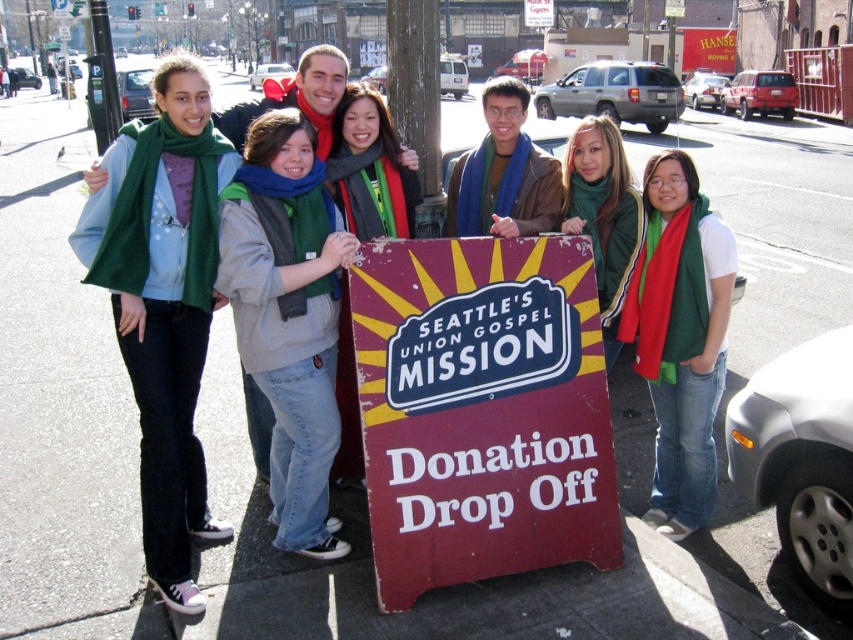
Question: Which point appears farthest from the camera in this image?

Choices:
 (A) (502, 536)
 (B) (332, 232)

Answer: (B)

Question: Based on their relative distances, which object is farther from the red scarf at center?

Choices:
 (A) blue scarf at center
 (B) gray fleece vest at center

Answer: (B)

Question: Is rusty metal sign at center to the left of blue scarf at center from the viewer's perspective?

Choices:
 (A) no
 (B) yes

Answer: (B)

Question: Which object appears farthest from the camera in this image?

Choices:
 (A) rusty metal sign at center
 (B) blue scarf at center
 (C) green fleece jacket at left

Answer: (B)

Question: Does gray fleece vest at center have a greater width compared to red scarf at center?

Choices:
 (A) no
 (B) yes

Answer: (B)

Question: Is rusty metal sign at center further to the viewer compared to green fleece scarf at center?

Choices:
 (A) yes
 (B) no

Answer: (B)